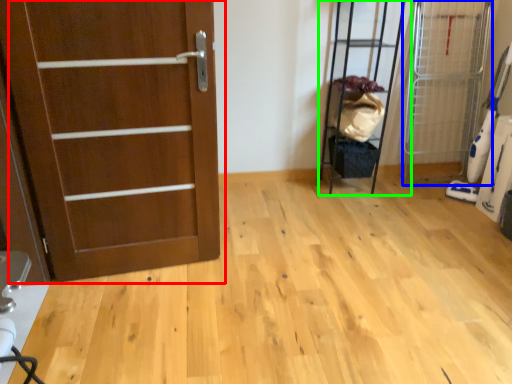
Question: Which is farther away from door (highlighted by a red box)? elevator (highlighted by a blue box) or elevator (highlighted by a green box)?

Choices:
 (A) elevator
 (B) elevator

Answer: (A)